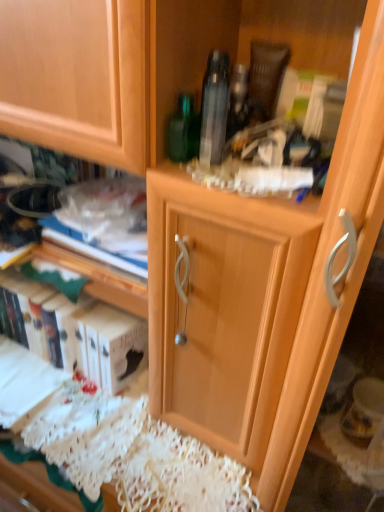
Find the location of a particular element. Image resolution: width=384 pixels, height=512 pixels. white paper book at left is located at coordinates (75, 332).

The height and width of the screenshot is (512, 384). What do you see at coordinates (75, 332) in the screenshot? I see `white paper book at left` at bounding box center [75, 332].

Identify the location of white paper book at left. (75, 332).